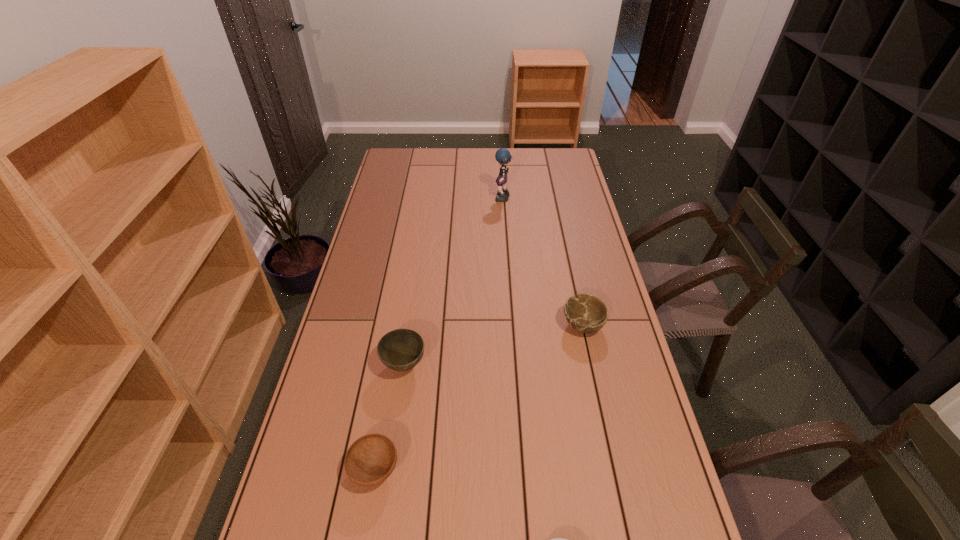
Select which bowl appears as the second closest to the shortest object. Please provide its 2D coordinates. Your answer should be formatted as a tuple, i.e. [(x, y)], where the tuple contains the x and y coordinates of a point satisfying the conditions above.

[(402, 349)]

Where is `vacant space that satisfies the following two spatial constraints: 1. on the back side of the tallest bowl; 2. on the left side of the fourth nearest object`? vacant space that satisfies the following two spatial constraints: 1. on the back side of the tallest bowl; 2. on the left side of the fourth nearest object is located at coordinates (410, 325).

The height and width of the screenshot is (540, 960). In order to click on vacant region that satisfies the following two spatial constraints: 1. on the front-facing side of the rag doll; 2. on the back side of the farthest bowl in this screenshot , I will do `click(511, 325)`.